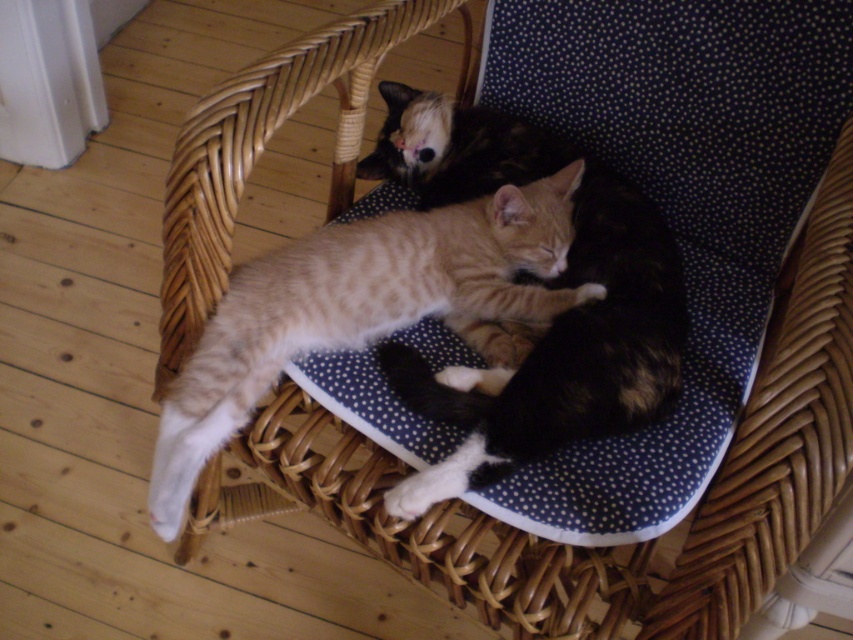
Question: Is tabby fur cat at center thinner than striped fur cat at center?

Choices:
 (A) yes
 (B) no

Answer: (A)

Question: Is tabby fur cat at center smaller than striped fur cat at center?

Choices:
 (A) no
 (B) yes

Answer: (A)

Question: Which point is farther from the camera taking this photo?

Choices:
 (A) (247, 292)
 (B) (521, 152)

Answer: (B)

Question: Can you confirm if tabby fur cat at center is thinner than striped fur cat at center?

Choices:
 (A) yes
 (B) no

Answer: (A)